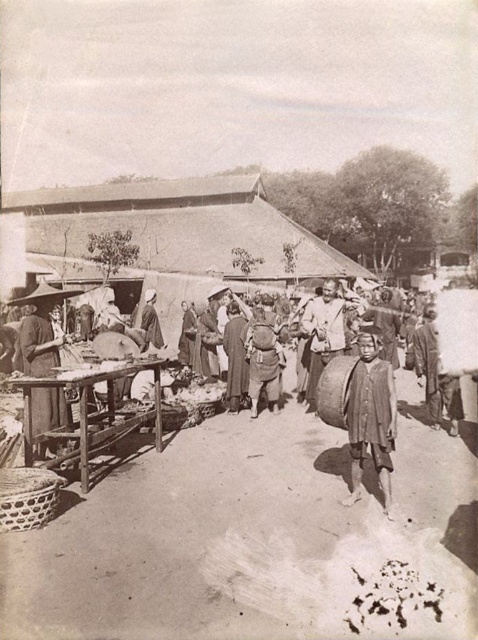
Between brown fabric child at center and smooth wooden table at left, which one appears on the right side from the viewer's perspective?

Positioned to the right is brown fabric child at center.

Who is more distant from viewer, (356, 368) or (39, 445)?

Positioned behind is point (39, 445).

The image size is (478, 640). I want to click on brown fabric child at center, so click(x=370, y=417).

Is brown fabric child at center shorter than smooth brown hat at center?

In fact, brown fabric child at center may be taller than smooth brown hat at center.

Looking at this image, which of these two, brown fabric child at center or smooth brown hat at center, stands taller?

With more height is brown fabric child at center.

Does point (358, 497) lie in front of point (150, 326)?

That is True.

The image size is (478, 640). Find the location of `brown fabric child at center`. brown fabric child at center is located at coordinates (370, 417).

Can you confirm if smooth wooden table at left is bigger than smooth brown hat at center?

Yes, smooth wooden table at left is bigger than smooth brown hat at center.

Does point (23, 324) lie behind point (162, 342)?

No, (23, 324) is closer to viewer.

What do you see at coordinates (39, 337) in the screenshot? I see `smooth wooden table at left` at bounding box center [39, 337].

This screenshot has height=640, width=478. I want to click on smooth wooden table at left, so click(39, 337).